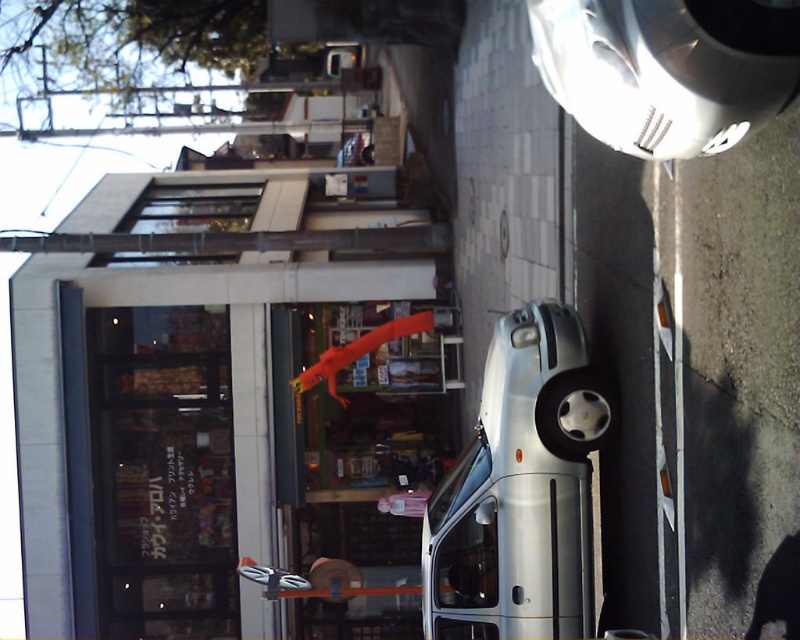
Question: Can you confirm if silver metallic van at center is positioned to the right of rubber orange lizard at center?

Choices:
 (A) no
 (B) yes

Answer: (B)

Question: Is silver metallic car at upper right above rubber orange lizard at center?

Choices:
 (A) yes
 (B) no

Answer: (A)

Question: Considering the relative positions of silver metallic car at upper right and rubber orange lizard at center in the image provided, where is silver metallic car at upper right located with respect to rubber orange lizard at center?

Choices:
 (A) right
 (B) left

Answer: (A)

Question: Which point is closer to the camera taking this photo?

Choices:
 (A) (641, 33)
 (B) (552, 378)

Answer: (A)

Question: Among these objects, which one is farthest from the camera?

Choices:
 (A) silver metallic van at center
 (B) silver metallic car at upper right

Answer: (A)

Question: Estimate the real-world distances between objects in this image. Which object is farther from the rubber orange lizard at center?

Choices:
 (A) silver metallic van at center
 (B) silver metallic car at upper right

Answer: (B)